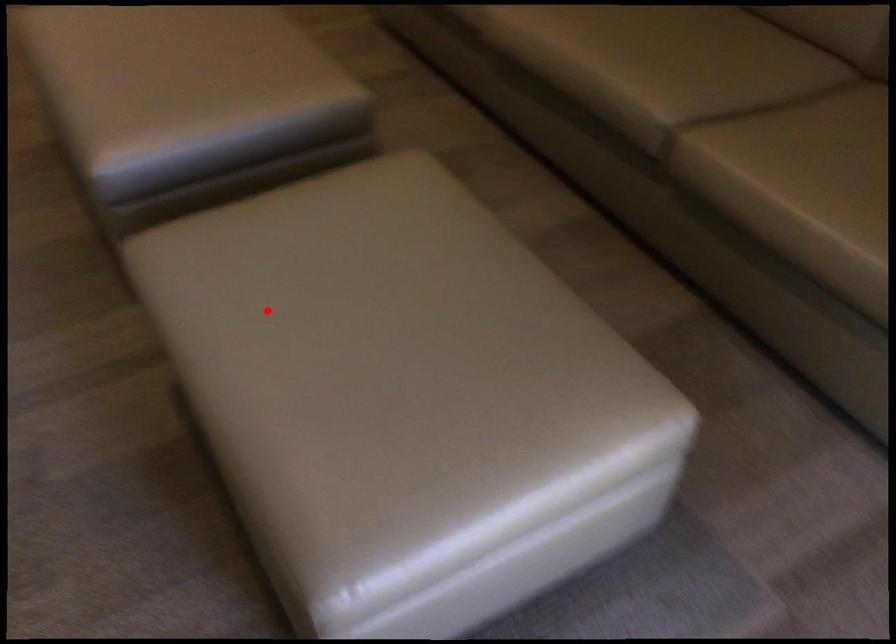
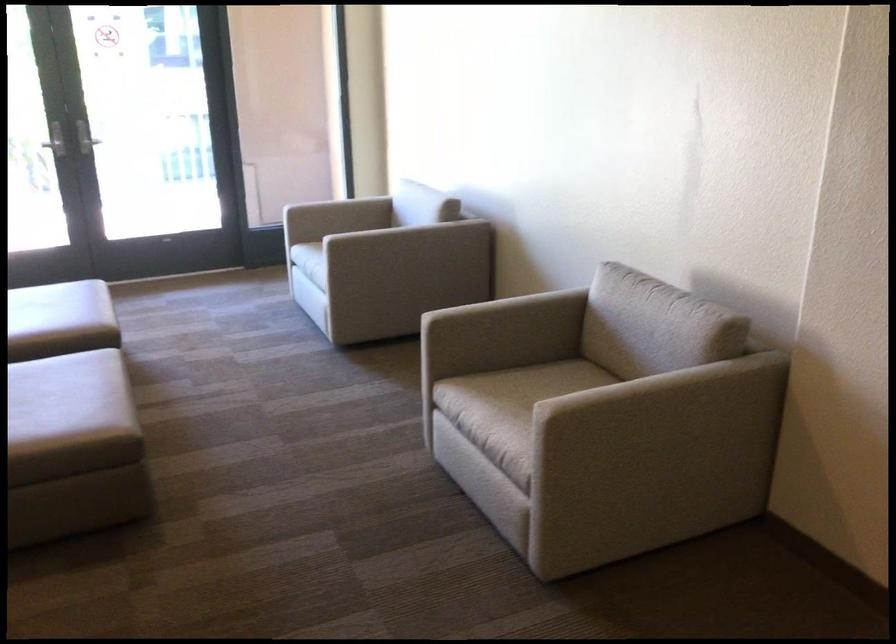
Find the pixel in the second image that matches the highlighted location in the first image.

(58, 308)